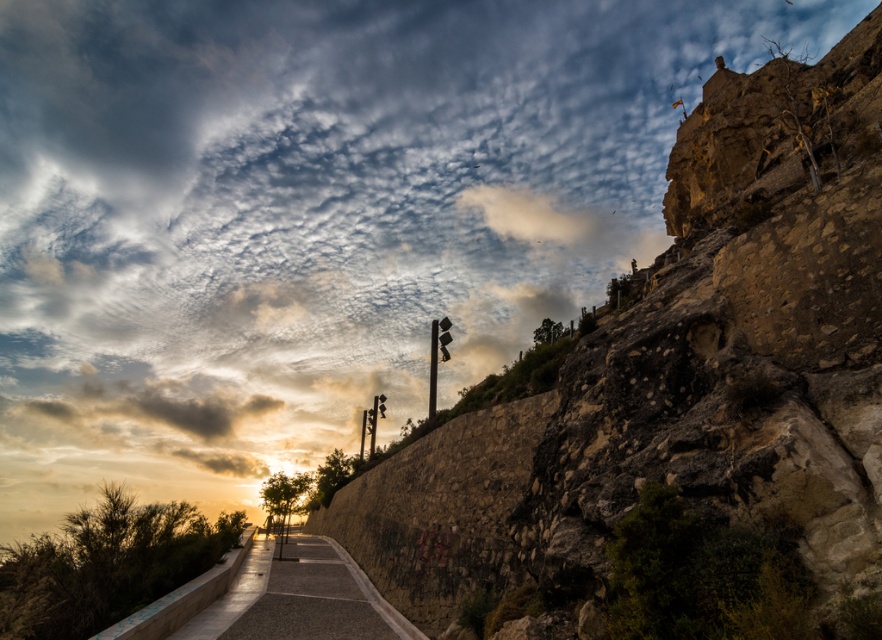
You are standing at the base of the hill looking up the pathway. There are two points marked on the image. Which point, point [791,456] or point [240,627], is closer to you?

Point [791,456] is closer to the viewer than point [240,627].